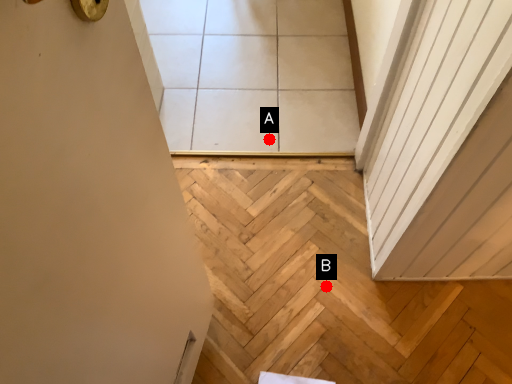
Question: Two points are circled on the image, labeled by A and B beside each circle. Which point is closer to the camera?

Choices:
 (A) A is closer
 (B) B is closer

Answer: (B)